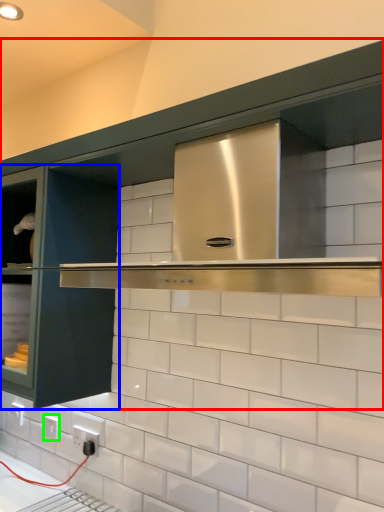
Question: Which is nearer to the cabinetry (highlighted by a red box)? glass door (highlighted by a blue box) or electric outlet (highlighted by a green box).

Choices:
 (A) glass door
 (B) electric outlet

Answer: (A)